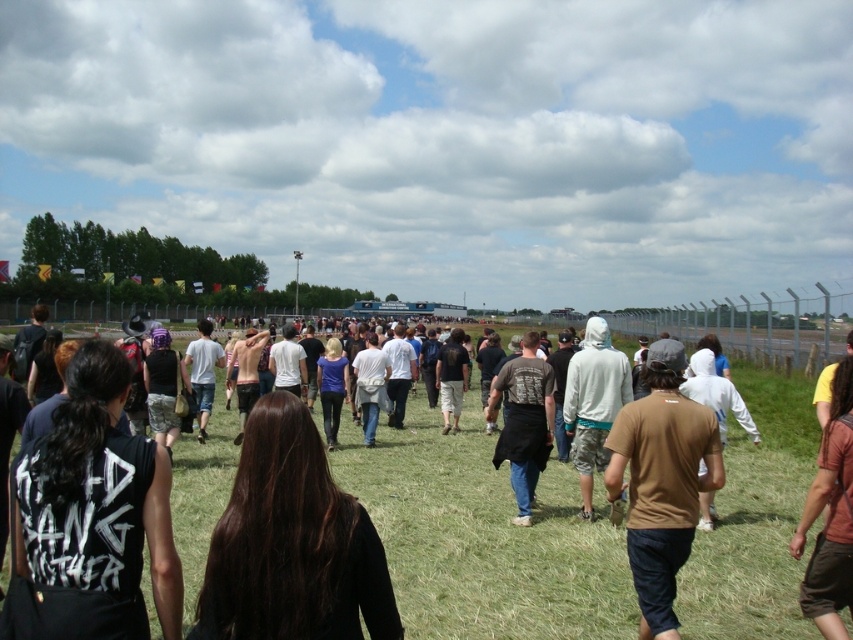
Question: Which point is closer to the camera taking this photo?

Choices:
 (A) (230, 630)
 (B) (206, 435)

Answer: (A)

Question: Considering the real-world distances, which object is farthest from the black fabric jacket at center?

Choices:
 (A) white cotton shirt at center
 (B) brown cotton t-shirt at right

Answer: (A)

Question: Is brown cotton t-shirt at right wider than camouflage pants at center?

Choices:
 (A) yes
 (B) no

Answer: (A)

Question: Does brown cotton t-shirt at right have a greater width compared to camouflage pants at center?

Choices:
 (A) no
 (B) yes

Answer: (B)

Question: Is brown cotton t-shirt at right bigger than camouflage pants at center?

Choices:
 (A) no
 (B) yes

Answer: (A)

Question: Based on their relative distances, which object is nearer to the black fabric shirt at center?

Choices:
 (A) brown fabric shirt at center-right
 (B) dark brown leather jacket at center
 (C) brown cotton t-shirt at right

Answer: (C)